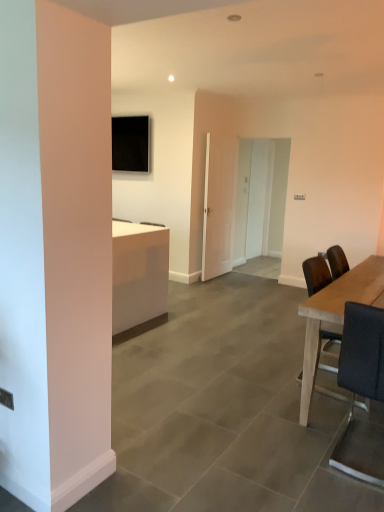
Question: Is white glossy door at center, the second glass door when ordered from front to back, oriented away from white glossy door at center, the third glass door when ordered from front to back?

Choices:
 (A) yes
 (B) no

Answer: (A)

Question: Is white glossy door at center, the 2th glass door from the back, wider than white glossy door at center, the third glass door when ordered from front to back?

Choices:
 (A) no
 (B) yes

Answer: (B)

Question: Would you say white glossy door at center, the second glass door when ordered from front to back, contains white glossy door at center, the third glass door when ordered from front to back?

Choices:
 (A) yes
 (B) no

Answer: (B)

Question: Can you confirm if white glossy door at center, the second glass door when ordered from front to back, is positioned to the left of white glossy door at center, which ranks as the 1th glass door in back-to-front order?

Choices:
 (A) yes
 (B) no

Answer: (A)

Question: Is white glossy door at center, the 2th glass door from the back, located outside white glossy door at center, which ranks as the 1th glass door in back-to-front order?

Choices:
 (A) no
 (B) yes

Answer: (B)

Question: Is light brown wooden table at right taller or shorter than black leather chair at right?

Choices:
 (A) short
 (B) tall

Answer: (A)

Question: Is light brown wooden table at right inside or outside of black leather chair at right?

Choices:
 (A) outside
 (B) inside

Answer: (A)

Question: Is light brown wooden table at right to the left or to the right of black leather chair at right in the image?

Choices:
 (A) right
 (B) left

Answer: (A)

Question: Is light brown wooden table at right in front of or behind black leather chair at right in the image?

Choices:
 (A) front
 (B) behind

Answer: (B)

Question: Is point (205, 141) positioned closer to the camera than point (347, 433)?

Choices:
 (A) farther
 (B) closer

Answer: (A)

Question: Would you say white glossy door at center, which is the first glass door from front to back, is to the left or to the right of black leather chair at right in the picture?

Choices:
 (A) right
 (B) left

Answer: (B)

Question: In terms of height, does white glossy door at center, which is the first glass door from front to back, look taller or shorter compared to black leather chair at right?

Choices:
 (A) tall
 (B) short

Answer: (A)

Question: Is white glossy door at center, which is the third glass door from back to front, spatially inside black leather chair at right, or outside of it?

Choices:
 (A) outside
 (B) inside

Answer: (A)

Question: In terms of height, does black leather chair at right look taller or shorter compared to white glossy door at center, which is the third glass door from back to front?

Choices:
 (A) short
 (B) tall

Answer: (A)

Question: Looking at their shapes, would you say black leather chair at right is wider or thinner than white glossy door at center, which is the first glass door from front to back?

Choices:
 (A) wide
 (B) thin

Answer: (A)